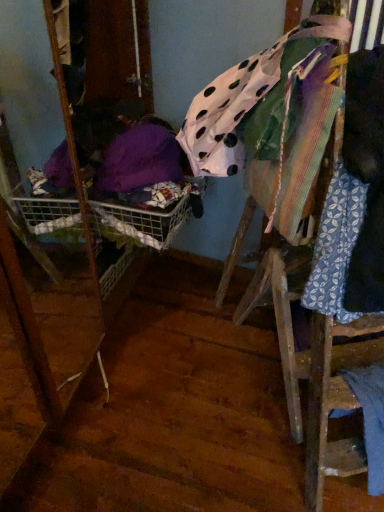
The image size is (384, 512). In order to click on blue fabric swivel chair at lower right in this screenshot , I will do `click(331, 407)`.

The height and width of the screenshot is (512, 384). Describe the element at coordinates (331, 407) in the screenshot. I see `blue fabric swivel chair at lower right` at that location.

The width and height of the screenshot is (384, 512). I want to click on blue fabric swivel chair at lower right, so click(331, 407).